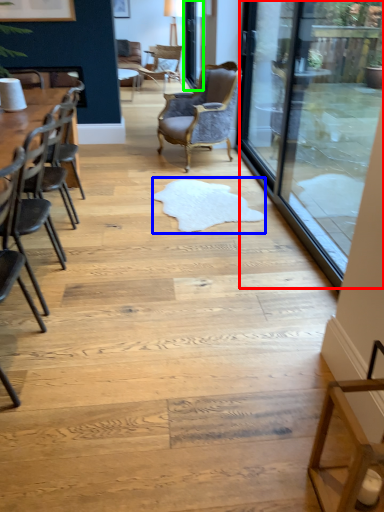
Question: Which object is positioned closest to glass door (highlighted by a red box)? Select from mat (highlighted by a blue box) and screen door (highlighted by a green box).

Choices:
 (A) mat
 (B) screen door

Answer: (A)